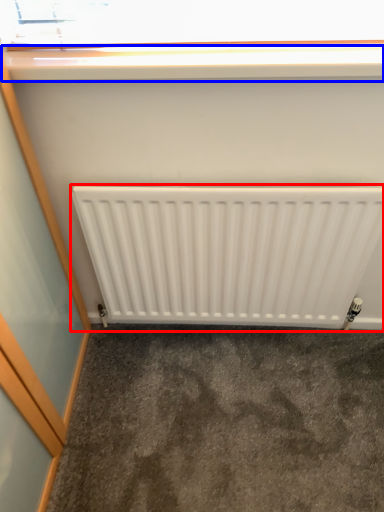
Question: Which object is closer to the camera taking this photo, radiator (highlighted by a red box) or window sill (highlighted by a blue box)?

Choices:
 (A) radiator
 (B) window sill

Answer: (B)